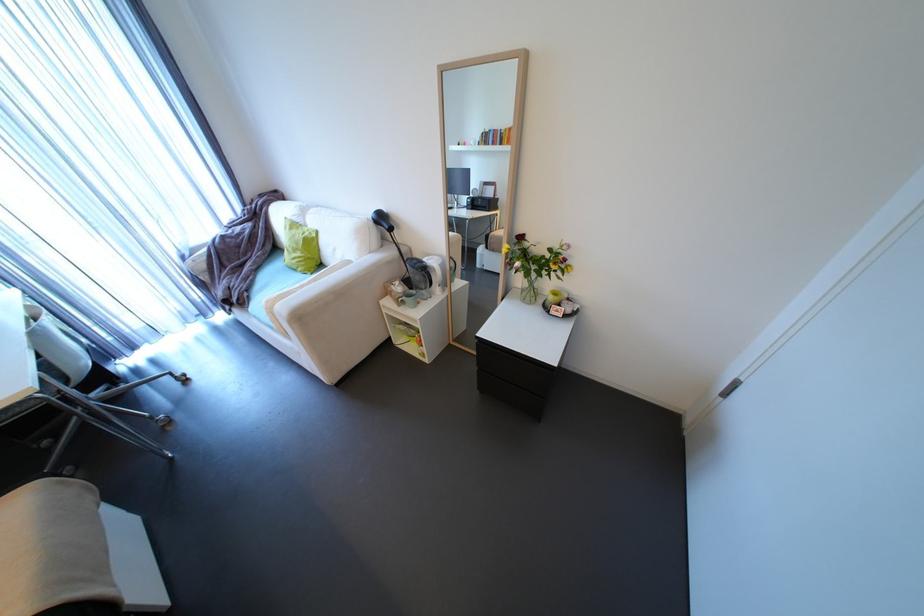
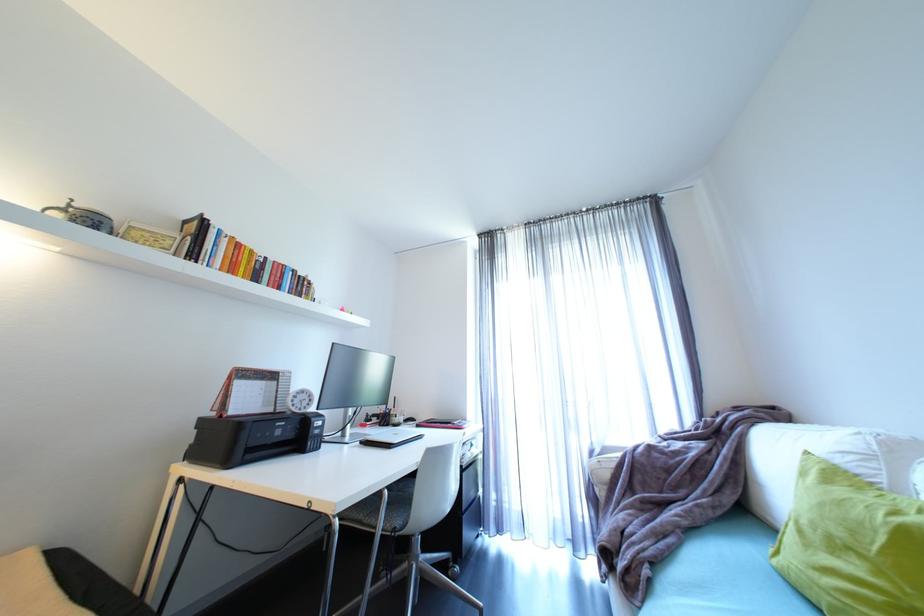
The point at [310,253] is marked in the first image. Where is the corresponding point in the second image?

(885, 573)